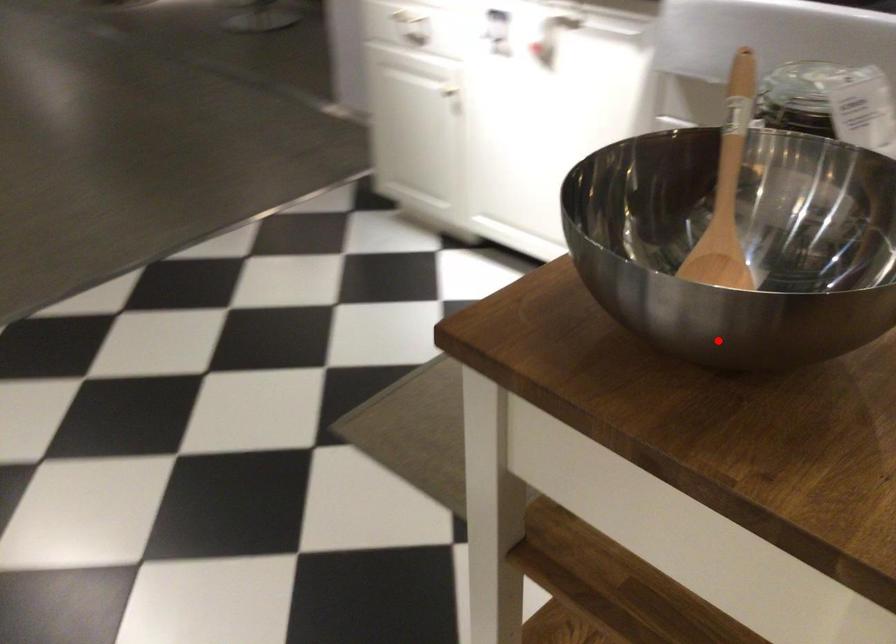
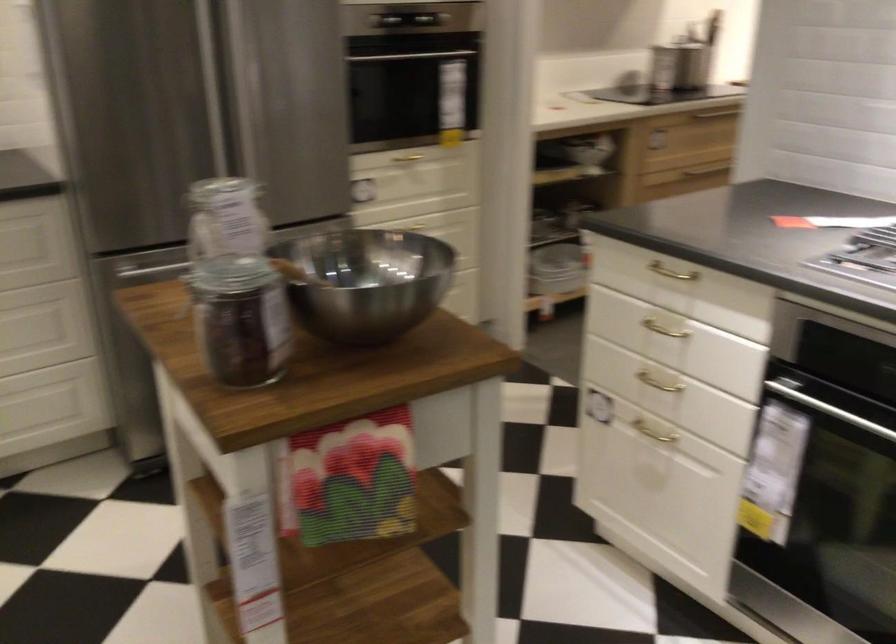
Question: A red point is marked in image1. In image2, is the corresponding 3D point closer to the camera or farther? Reply with the corresponding letter.

Choices:
 (A) The corresponding 3D point is closer.
 (B) The corresponding 3D point is farther.

Answer: (B)